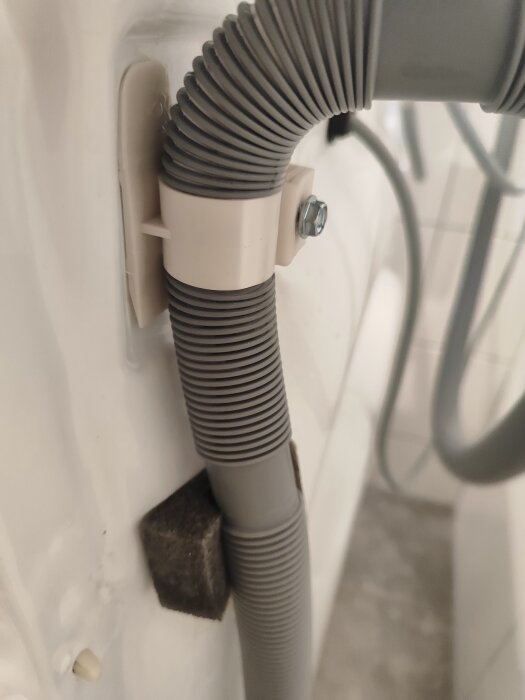
At what (x,y) coordinates should I click in order to perform the action: click on floor. Please return your answer as a coordinate pair (x, y). The height and width of the screenshot is (700, 525). Looking at the image, I should click on (379, 593).